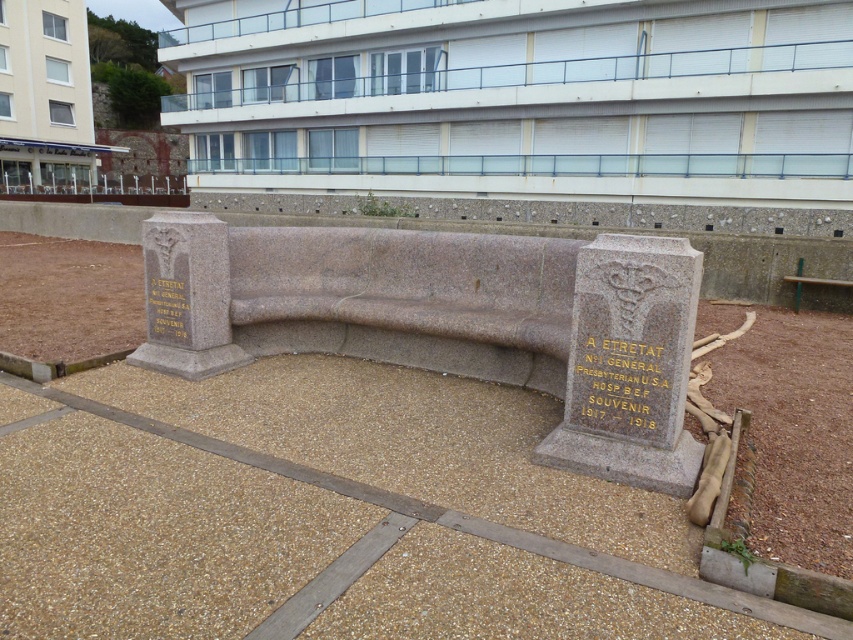
Question: Can you confirm if granite bench at center is smaller than gold metallic plaque at left?

Choices:
 (A) no
 (B) yes

Answer: (A)

Question: From the image, what is the correct spatial relationship of goldmaterial/textureinscription at center in relation to gold metallic plaque at left?

Choices:
 (A) left
 (B) right

Answer: (B)

Question: Which object is positioned farthest from the goldmaterial/textureinscription at center?

Choices:
 (A) gold metallic plaque at left
 (B) granite bench at center

Answer: (A)

Question: Based on their relative distances, which object is farther from the granite bench at center?

Choices:
 (A) gold metallic plaque at left
 (B) goldmaterial/textureinscription at center

Answer: (B)

Question: Which of the following is the farthest from the observer?

Choices:
 (A) goldmaterial/textureinscription at center
 (B) granite bench at center

Answer: (B)

Question: Considering the relative positions of granite bench at center and goldmaterial/textureinscription at center in the image provided, where is granite bench at center located with respect to goldmaterial/textureinscription at center?

Choices:
 (A) right
 (B) left

Answer: (B)